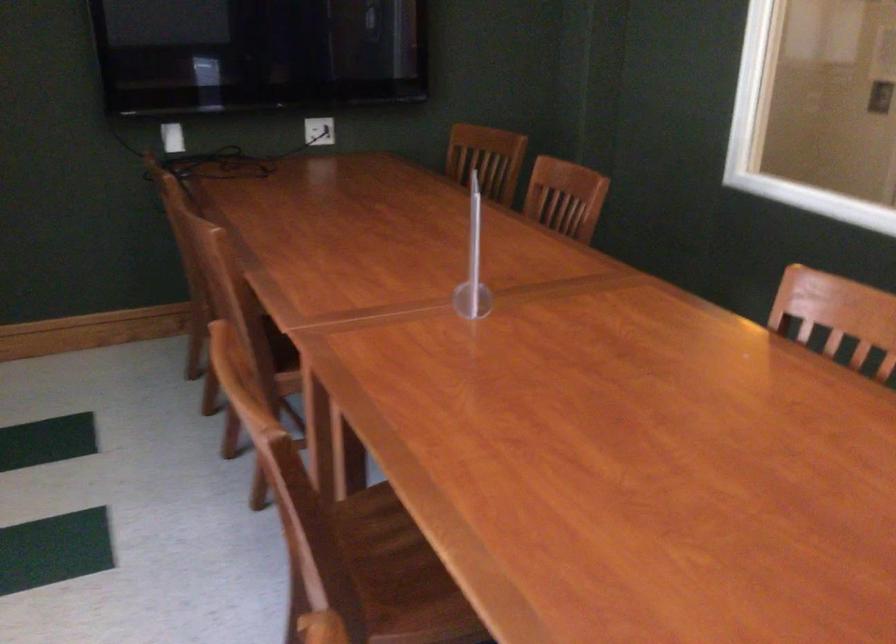
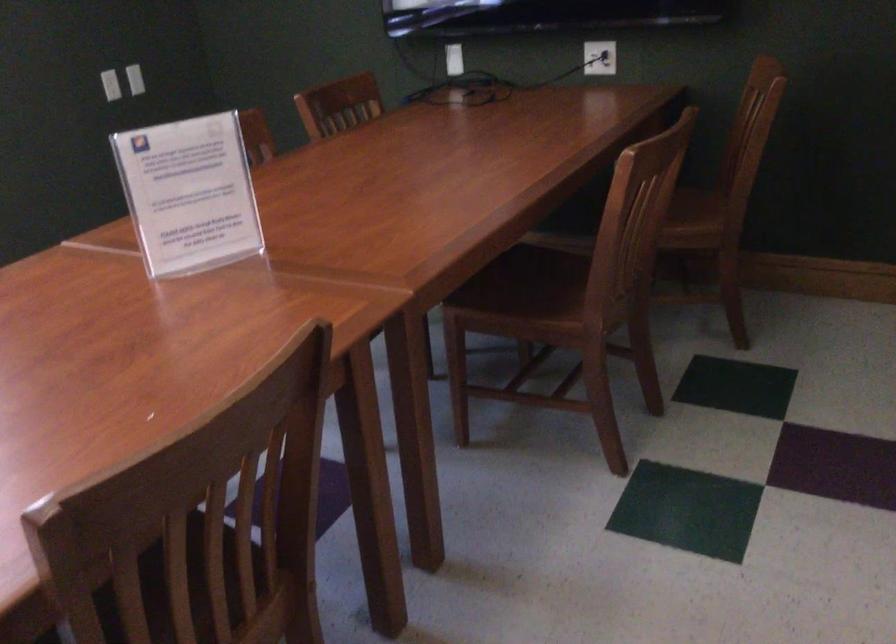
Where in the second image is the point corresponding to the point at 191,138 from the first image?

(453, 59)